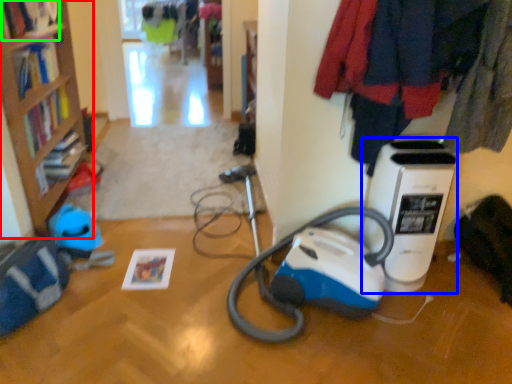
Question: Which object is the closest to the bookcase (highlighted by a red box)? Choose among these: home appliance (highlighted by a blue box) or book (highlighted by a green box).

Choices:
 (A) home appliance
 (B) book

Answer: (B)